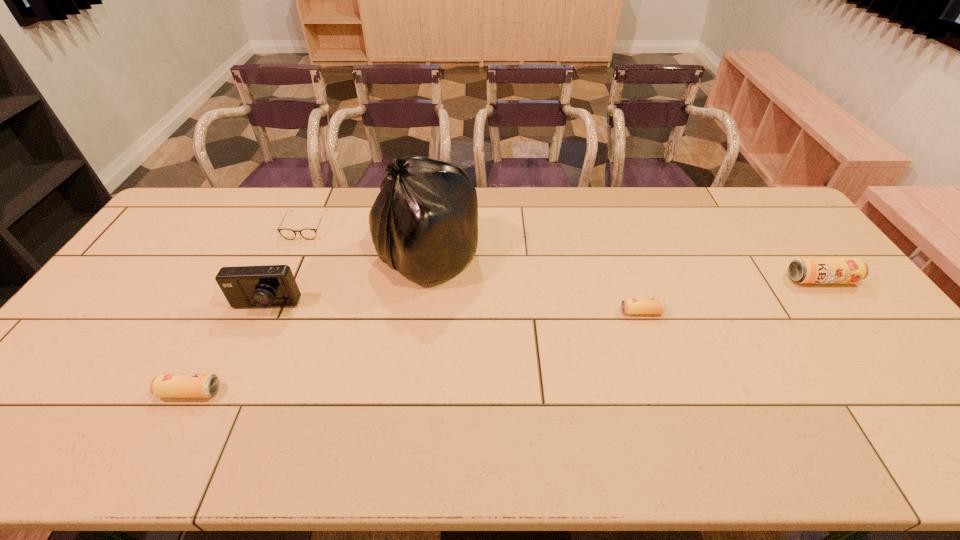
Identify the location of the leftmost beer can. This screenshot has width=960, height=540. (165, 385).

In order to click on the fourth tallest object in this screenshot , I will do `click(165, 385)`.

In order to click on the fifth object from left to right in this screenshot , I will do `click(629, 306)`.

Locate an element on the screen. Image resolution: width=960 pixels, height=540 pixels. the second beer can from right to left is located at coordinates (629, 306).

I want to click on the farthest beer can, so click(x=801, y=270).

Find the location of a particular element. The image size is (960, 540). the rightmost object is located at coordinates (801, 270).

I want to click on the fifth shortest object, so click(265, 286).

The height and width of the screenshot is (540, 960). In order to click on spectacles in this screenshot , I will do `click(289, 234)`.

I want to click on the fourth object from left to right, so click(x=424, y=222).

Locate an element on the screen. plastic bag is located at coordinates (424, 222).